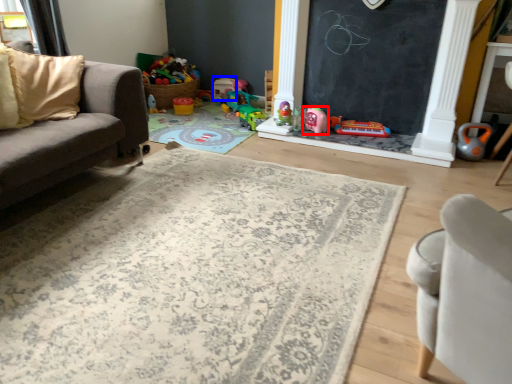
Question: Which of the following is the farthest to the observer, toy (highlighted by a red box) or toy (highlighted by a blue box)?

Choices:
 (A) toy
 (B) toy

Answer: (B)